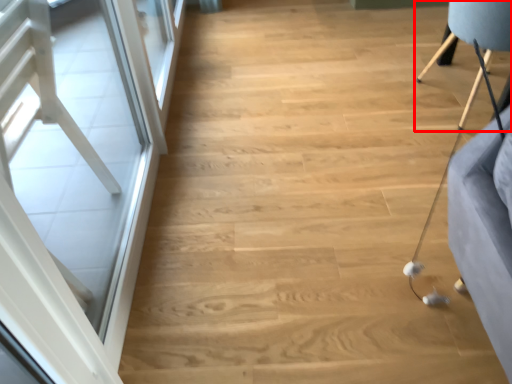
Question: From the image's perspective, what is the correct spatial positioning of furniture (annotated by the red box) in reference to screen door?

Choices:
 (A) below
 (B) above

Answer: (B)